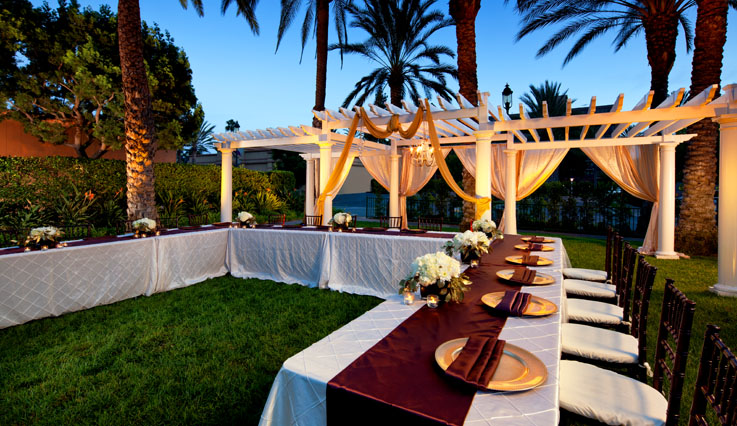
At what (x,y) coordinates should I click in order to perform the action: click on curtains. Please return your answer as a coordinate pair (x, y). Looking at the image, I should click on (615, 166), (534, 164), (497, 165), (410, 172), (376, 166), (328, 166).